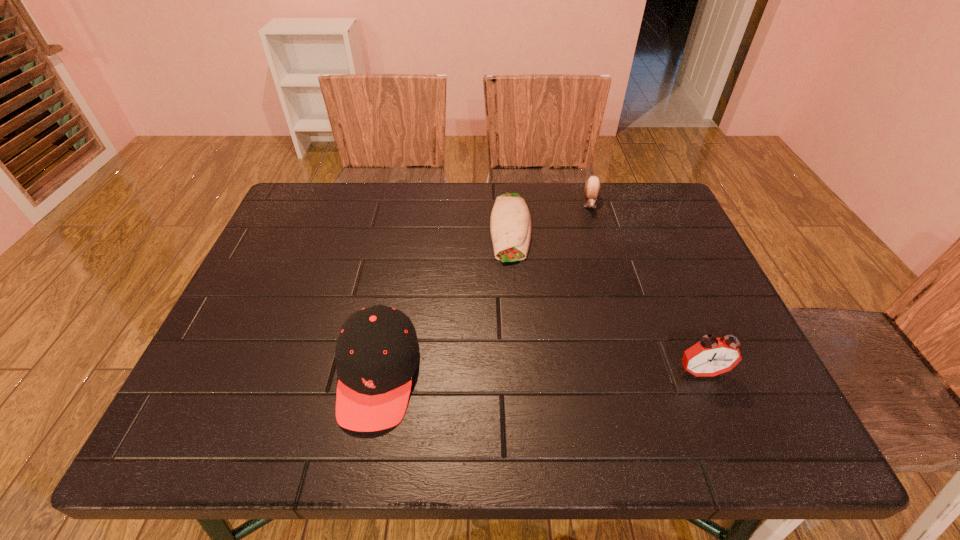
This screenshot has height=540, width=960. I want to click on free space at the left edge of the desktop, so click(289, 269).

Identify the location of vacant area at the right edge of the desktop. (658, 298).

Identify the location of vacant space at the far left corner of the desktop. The height and width of the screenshot is (540, 960). (313, 194).

This screenshot has width=960, height=540. I want to click on blank space at the far right corner, so click(676, 217).

Locate an element on the screen. free space between the second object from right to left and the leftmost object is located at coordinates click(485, 289).

Locate an element on the screen. The image size is (960, 540). vacant area that lies between the escargot and the alarm clock is located at coordinates 646,288.

Where is `empty space that is in between the third tallest object and the shortest object`? empty space that is in between the third tallest object and the shortest object is located at coordinates (551, 215).

At what (x,y) coordinates should I click in order to perform the action: click on vacant area between the cap and the third object from right to left. Please return your answer as a coordinate pair (x, y). Image resolution: width=960 pixels, height=540 pixels. Looking at the image, I should click on (444, 301).

You are a GUI agent. You are given a task and a screenshot of the screen. Output one action in this format:
    pyautogui.click(x=<x>, y=<y>)
    Task: Click on the vacant area that lies between the cap and the burrito
    This screenshot has width=960, height=540.
    Given the screenshot: What is the action you would take?
    pyautogui.click(x=444, y=301)

Find the location of a particular element. The width and height of the screenshot is (960, 540). vacant area that lies between the cap and the third object from right to left is located at coordinates (444, 301).